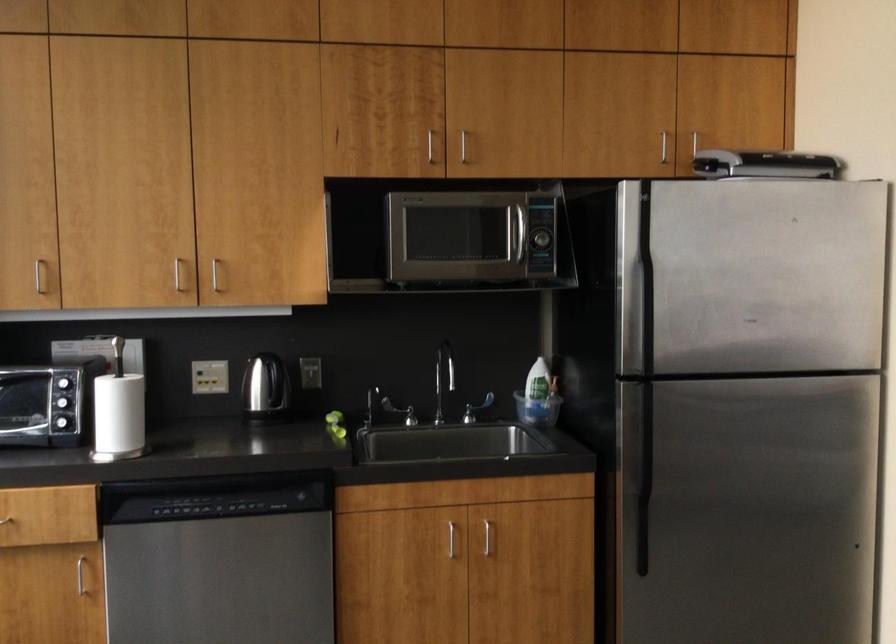
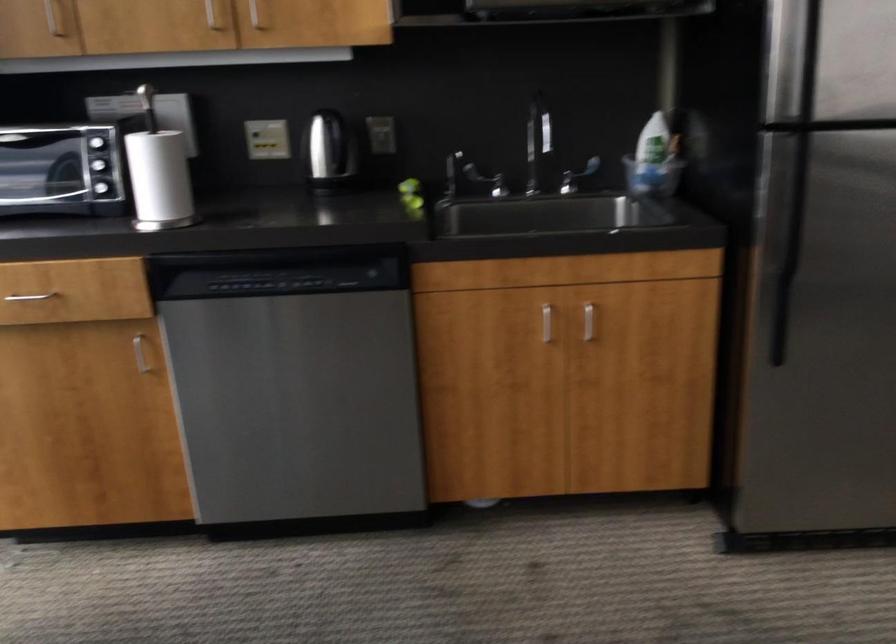
Locate, in the second image, the point that corresponds to pixel 82 574 in the first image.

(140, 354)